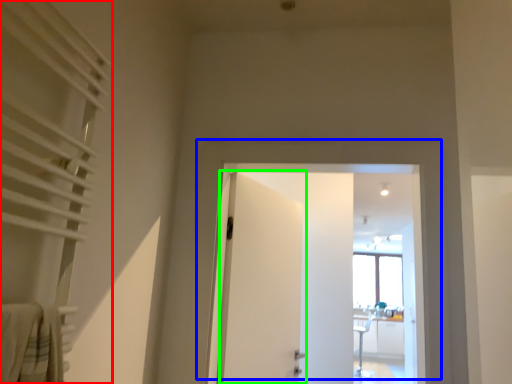
Question: Considering the real-world distances, which object is farthest from curtain (highlighted by a red box)? door (highlighted by a blue box) or door (highlighted by a green box)?

Choices:
 (A) door
 (B) door

Answer: (B)